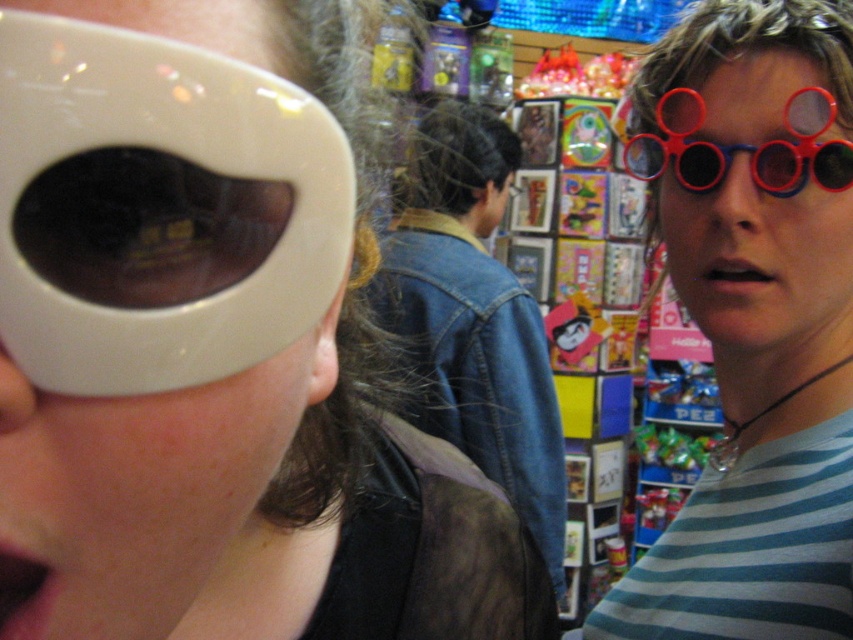
Question: Which of the following is the closest to the observer?

Choices:
 (A) matte white sunglasses at upper left
 (B) red plastic goggles at upper right
 (C) matte black sunglasses at center
 (D) denim jacket at center

Answer: (A)

Question: Among these points, which one is farthest from the camera?

Choices:
 (A) (123, 339)
 (B) (711, 275)
 (C) (451, 365)
 (D) (717, 250)

Answer: (C)

Question: In this image, where is denim jacket at center located relative to matte plastic glasses at right?

Choices:
 (A) below
 (B) above

Answer: (A)

Question: Considering the relative positions of denim jacket at center and pink matte skin at center in the image provided, where is denim jacket at center located with respect to pink matte skin at center?

Choices:
 (A) above
 (B) below

Answer: (A)

Question: Which is nearer to the matte plastic glasses at center?

Choices:
 (A) matte black sunglasses at center
 (B) red plastic goggles at upper right
 (C) pink flesh at lower left

Answer: (B)

Question: Does matte plastic glasses at center have a lesser width compared to red plastic goggles at upper right?

Choices:
 (A) yes
 (B) no

Answer: (B)